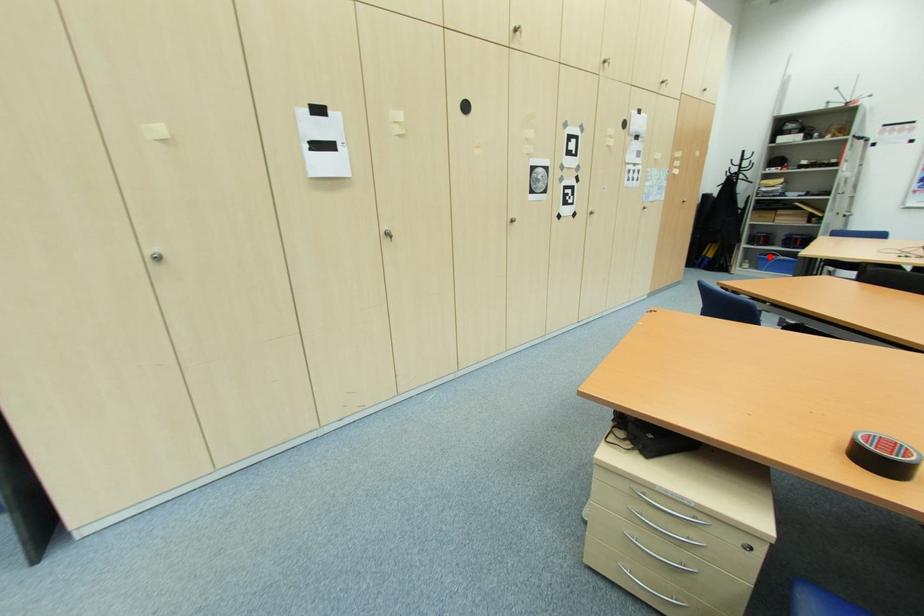
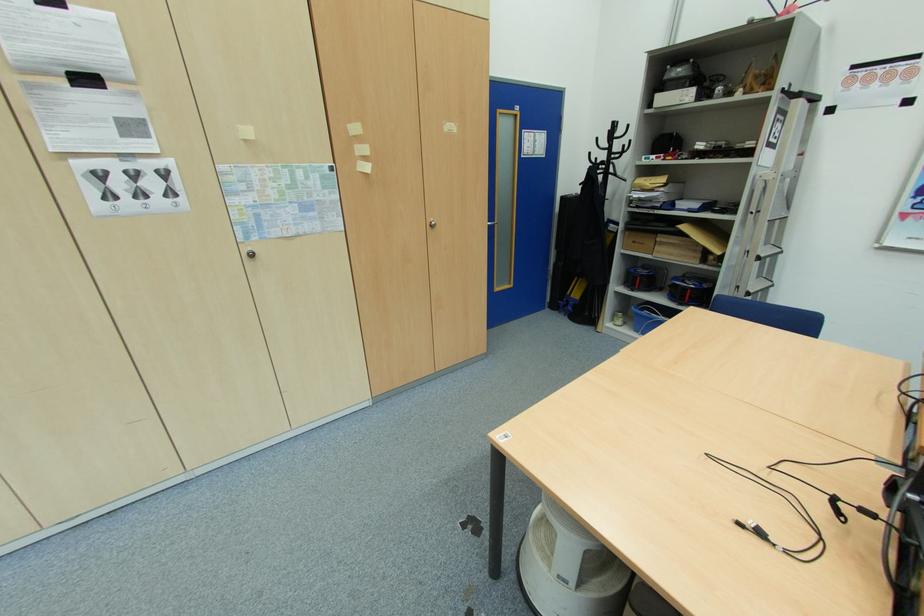
Question: I am providing you with two images of the same scene from different viewpoints. Image1 has a red point marked. In image2, the corresponding 3D location appears at what relative position? Reply with the corresponding letter.

Choices:
 (A) Closer
 (B) Farther

Answer: (A)